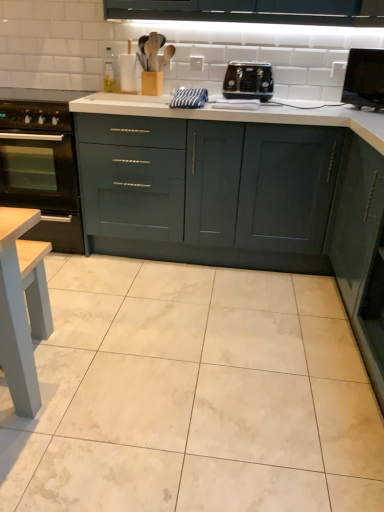
What are the coordinates of `vacant area to the left of black glossy monitor at upper right` in the screenshot? It's located at (321, 104).